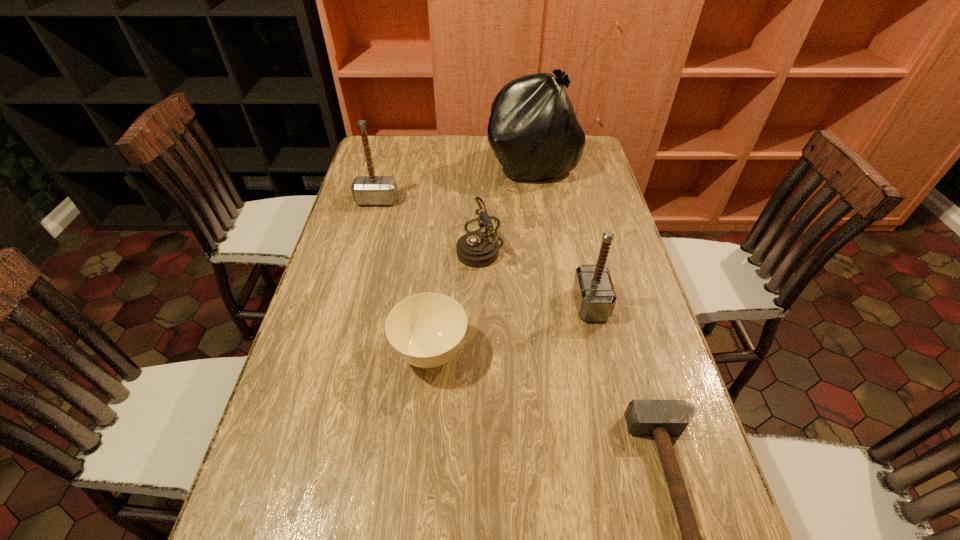
This screenshot has height=540, width=960. In order to click on blank area located 0.400m on the front of the third tallest object in this screenshot , I will do `click(634, 496)`.

Locate an element on the screen. This screenshot has height=540, width=960. free region located 0.280m on the left of the third farthest object is located at coordinates (363, 241).

Find the location of a particular element. This screenshot has width=960, height=540. vacant space located on the right of the sugar bowl is located at coordinates (592, 353).

Where is `object that is at the far edge`? Image resolution: width=960 pixels, height=540 pixels. object that is at the far edge is located at coordinates (533, 130).

Find the location of `object present at the left edge`. object present at the left edge is located at coordinates (367, 190).

What are the coordinates of `plastic bag that is at the right edge` in the screenshot? It's located at (533, 130).

Find the location of a particular element. The height and width of the screenshot is (540, 960). hammer present at the right edge is located at coordinates (595, 297).

Locate an element on the screen. Image resolution: width=960 pixels, height=540 pixels. object present at the far right corner is located at coordinates coord(533,130).

The height and width of the screenshot is (540, 960). Find the location of `vacant space at the left edge`. vacant space at the left edge is located at coordinates (368, 241).

Find the location of a particular element. blank space at the right edge is located at coordinates (619, 446).